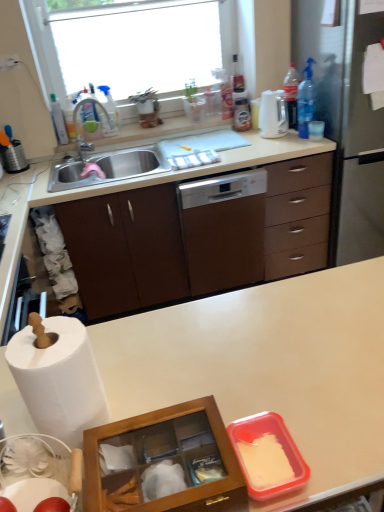
The image size is (384, 512). Find the location of `vacant area that is in front of blue translucent bottle at upper right, which appears as the fourth bottle when viewed from the left`. vacant area that is in front of blue translucent bottle at upper right, which appears as the fourth bottle when viewed from the left is located at coordinates (310, 144).